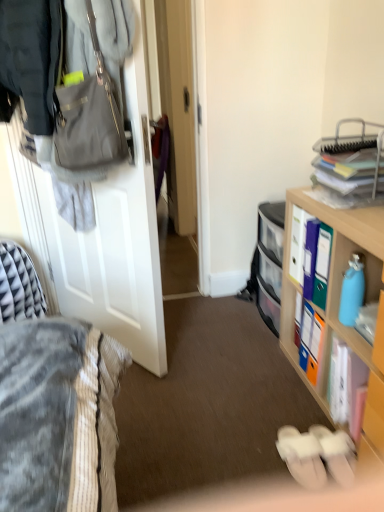
Question: Can you confirm if white fabric slippers at lower center, positioned as the second footwear in left-to-right order, is shorter than clear plastic drawers at center?

Choices:
 (A) no
 (B) yes

Answer: (B)

Question: Is the position of white fabric slippers at lower center, the first footwear positioned from the right, less distant than that of clear plastic drawers at center?

Choices:
 (A) no
 (B) yes

Answer: (B)

Question: From the image's perspective, would you say white fabric slippers at lower center, the first footwear positioned from the right, is shown under clear plastic drawers at center?

Choices:
 (A) no
 (B) yes

Answer: (B)

Question: From the image's perspective, is white fabric slippers at lower center, the first footwear positioned from the right, located above clear plastic drawers at center?

Choices:
 (A) yes
 (B) no

Answer: (B)

Question: Is white fabric slippers at lower center, positioned as the second footwear in left-to-right order, not close to clear plastic drawers at center?

Choices:
 (A) no
 (B) yes

Answer: (A)

Question: In terms of size, does white fabric slippers at lower center, the first footwear positioned from the right, appear bigger or smaller than white paper book at lower right?

Choices:
 (A) small
 (B) big

Answer: (A)

Question: Based on their positions, is white fabric slippers at lower center, positioned as the second footwear in left-to-right order, located to the left or right of white paper book at lower right?

Choices:
 (A) right
 (B) left

Answer: (B)

Question: Do you think white fabric slippers at lower center, positioned as the second footwear in left-to-right order, is within white paper book at lower right, or outside of it?

Choices:
 (A) inside
 (B) outside

Answer: (B)

Question: Relative to white paper book at lower right, is white fabric slippers at lower center, the first footwear positioned from the right, in front or behind?

Choices:
 (A) behind
 (B) front

Answer: (A)

Question: Would you say white fabric slippers at lower center, the 2th footwear viewed from the right, is inside or outside white matte door at left?

Choices:
 (A) inside
 (B) outside

Answer: (B)

Question: Looking at the image, does white fabric slippers at lower center, the first footwear from the left, seem bigger or smaller compared to white matte door at left?

Choices:
 (A) small
 (B) big

Answer: (A)

Question: Would you say white fabric slippers at lower center, the first footwear from the left, is to the left or to the right of white matte door at left in the picture?

Choices:
 (A) right
 (B) left

Answer: (A)

Question: From their relative heights in the image, would you say white fabric slippers at lower center, the 2th footwear viewed from the right, is taller or shorter than white matte door at left?

Choices:
 (A) tall
 (B) short

Answer: (B)

Question: From a real-world perspective, is white paper book at lower right above or below white matte door at left?

Choices:
 (A) below
 (B) above

Answer: (A)

Question: Is white paper book at lower right to the left or to the right of white matte door at left in the image?

Choices:
 (A) right
 (B) left

Answer: (A)